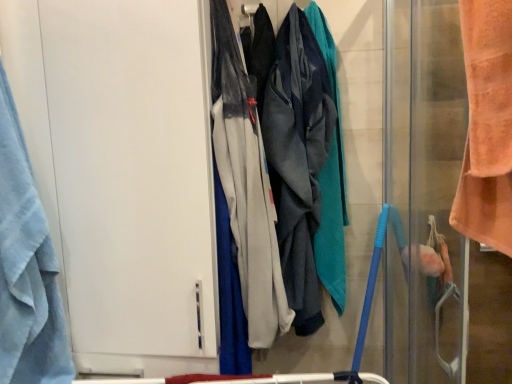
Question: In the image, is orange towel at right, which appears as the first screen door when viewed from the right, positioned in front of or behind blue terry cloth towel at left?

Choices:
 (A) front
 (B) behind

Answer: (A)

Question: Is orange towel at right, which appears as the first screen door when viewed from the right, inside the boundaries of blue terry cloth towel at left, or outside?

Choices:
 (A) inside
 (B) outside

Answer: (B)

Question: Which is farther from the gray fabric pants at center, the 1th wide when ordered from front to back?

Choices:
 (A) orange towel at right, which appears as the first screen door when viewed from the right
 (B) textured gray hoodie at center, which is the second wide from front to back
 (C) blue terry cloth towel at left
 (D) white matte door at left, positioned as the 1th screen door in left-to-right order

Answer: (C)

Question: Estimate the real-world distances between objects in this image. Which object is closer to the gray fabric pants at center, which is the second wide in back-to-front order?

Choices:
 (A) white matte door at left, the second screen door when ordered from right to left
 (B) blue terry cloth towel at left
 (C) textured gray hoodie at center, which is the second wide from front to back
 (D) orange towel at right, positioned as the second screen door in left-to-right order

Answer: (C)